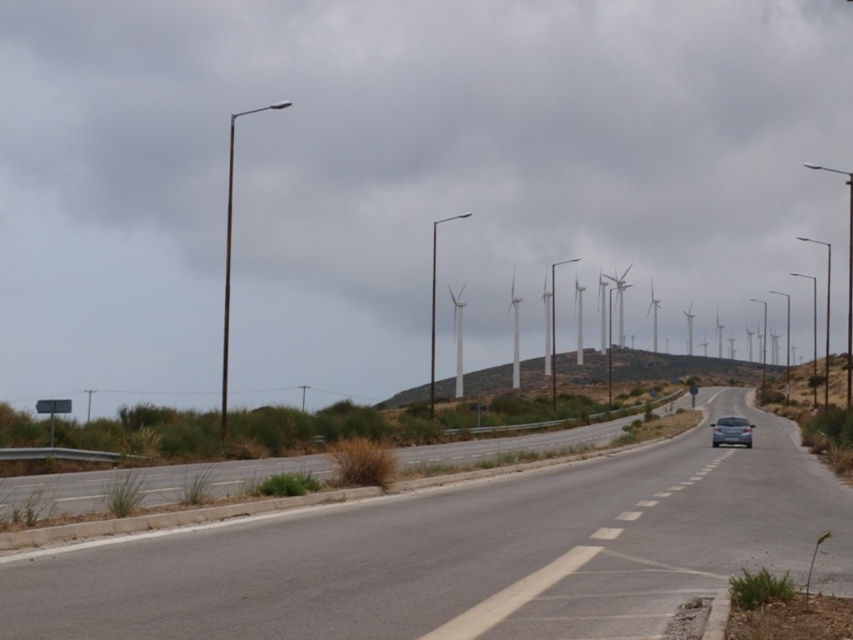
Question: Is asphalt road at center above satin silver sedan at center-right?

Choices:
 (A) yes
 (B) no

Answer: (A)

Question: Which point appears closest to the camera in this image?

Choices:
 (A) (717, 436)
 (B) (61, 554)

Answer: (B)

Question: Can you confirm if asphalt road at center is positioned below satin silver sedan at center-right?

Choices:
 (A) yes
 (B) no

Answer: (B)

Question: Which point is closer to the camera?

Choices:
 (A) (743, 419)
 (B) (788, 490)

Answer: (B)

Question: Can you confirm if asphalt road at center is positioned to the left of satin silver sedan at center-right?

Choices:
 (A) yes
 (B) no

Answer: (A)

Question: Among these points, which one is nearest to the camera?

Choices:
 (A) (514, 573)
 (B) (735, 419)

Answer: (A)